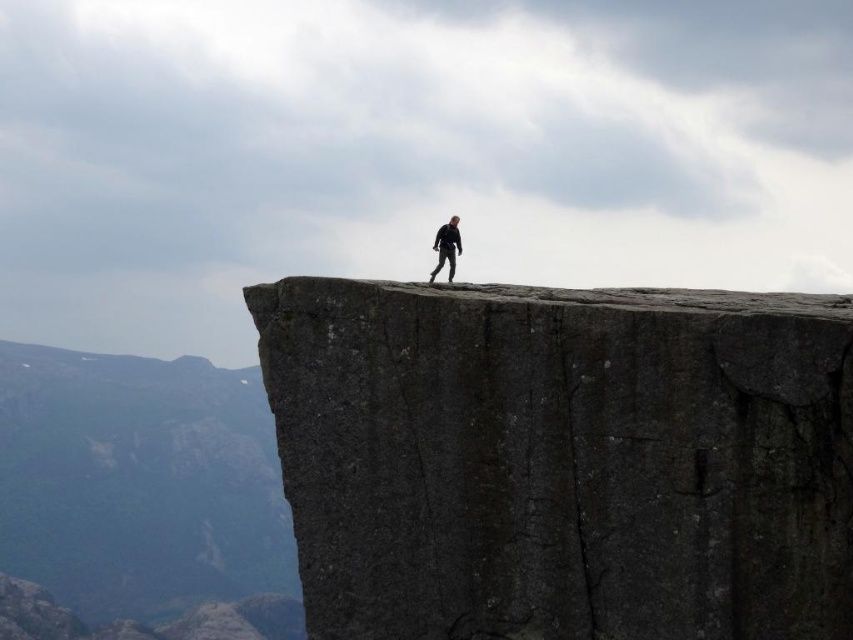
You are a hiker who wants to climb the dark gray stone at center. You notice there is also a dark gray rock at center nearby. Which one is higher up in the scene?

The dark gray stone at center is located above the dark gray rock at center, so the dark gray stone at center is higher up in the scene.

You are a photographer planning to capture the silhouette of the black matte suit at center against the sky. Since the dark gray rock at center is in the way, can you still take the photo by moving to a different position?

The black matte suit at center is behind the dark gray rock at center, so you cannot take the photo from the current position. However, moving to a position where the dark gray rock at center is no longer blocking the view of the black matte suit at center would allow you to capture the silhouette.